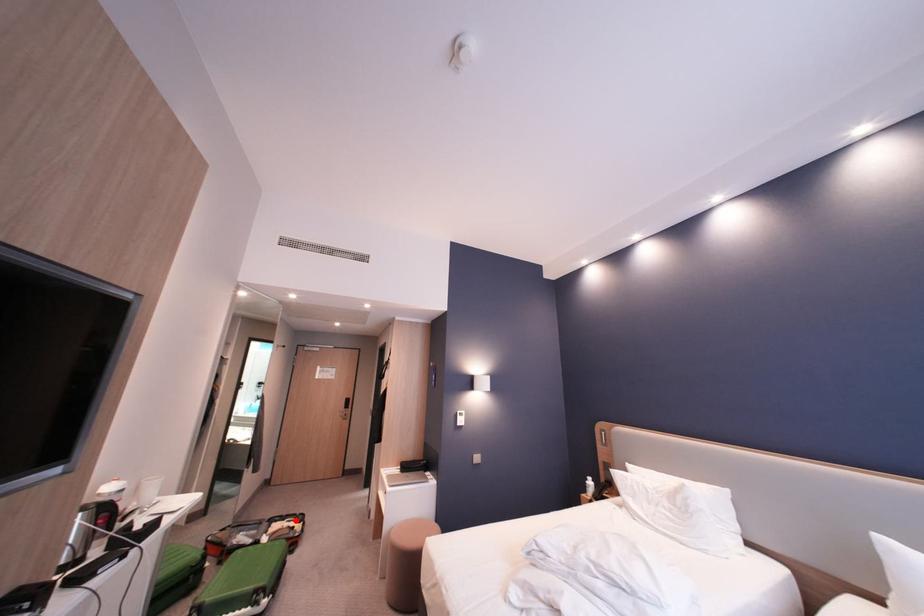
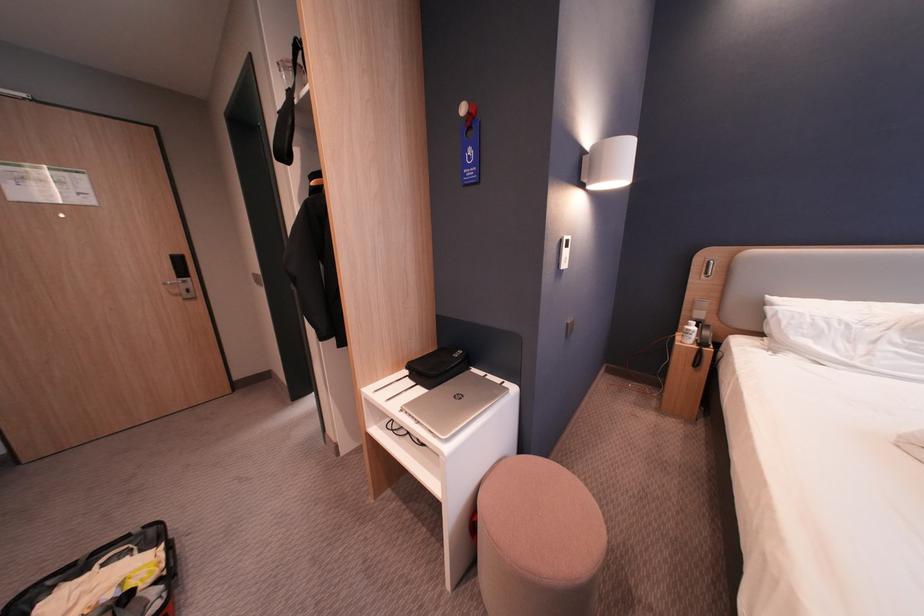
Where in the second image is the point corresponding to the highlighted location from the first image?

(99, 572)